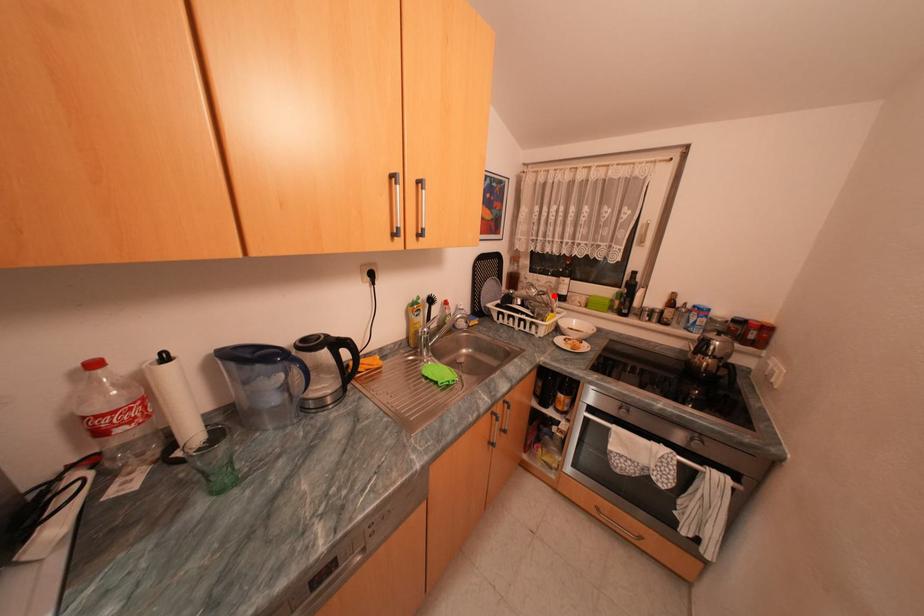
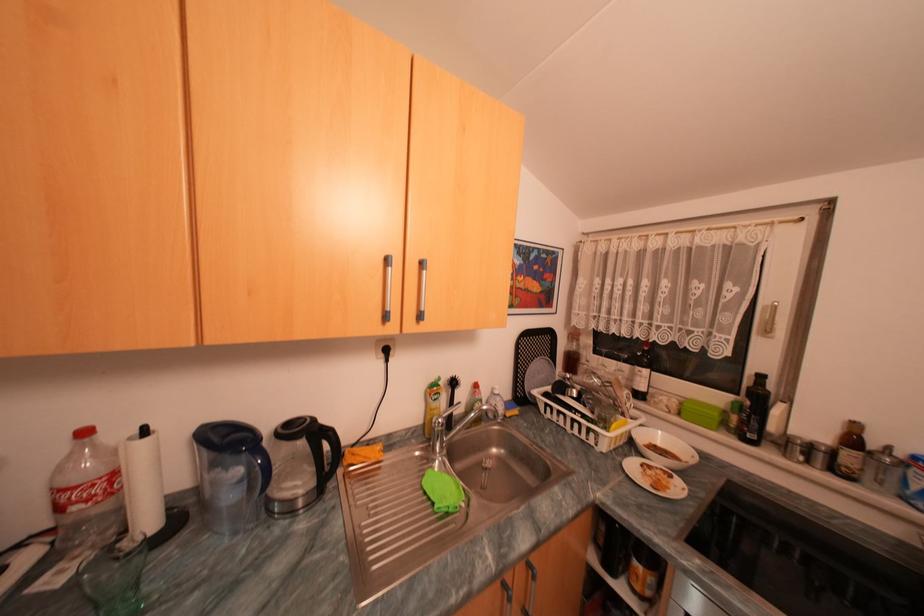
In the second image, find the point that corresponds to the highlighted location in the first image.

(622, 389)